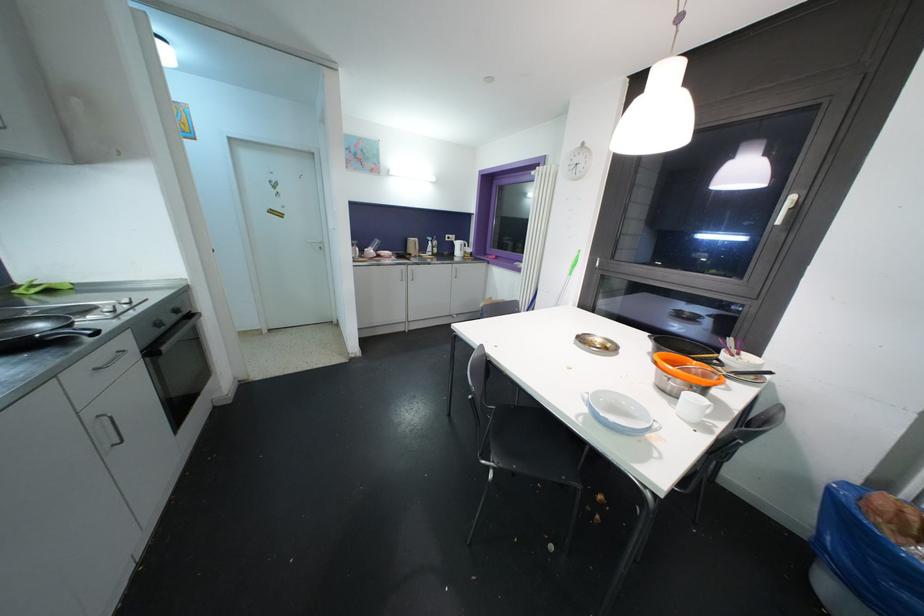
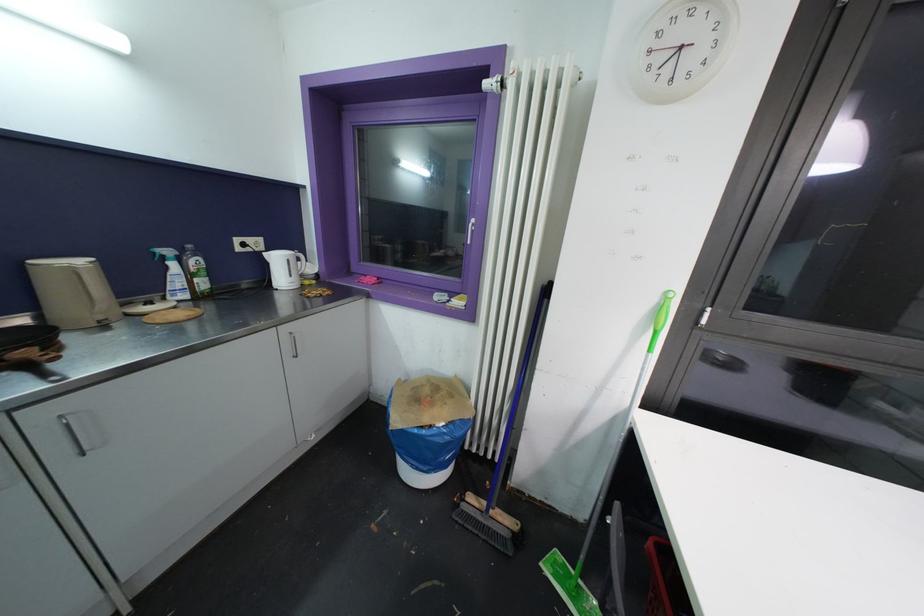
Where in the second image is the point corresponding to point (432, 241) from the first image?

(171, 254)